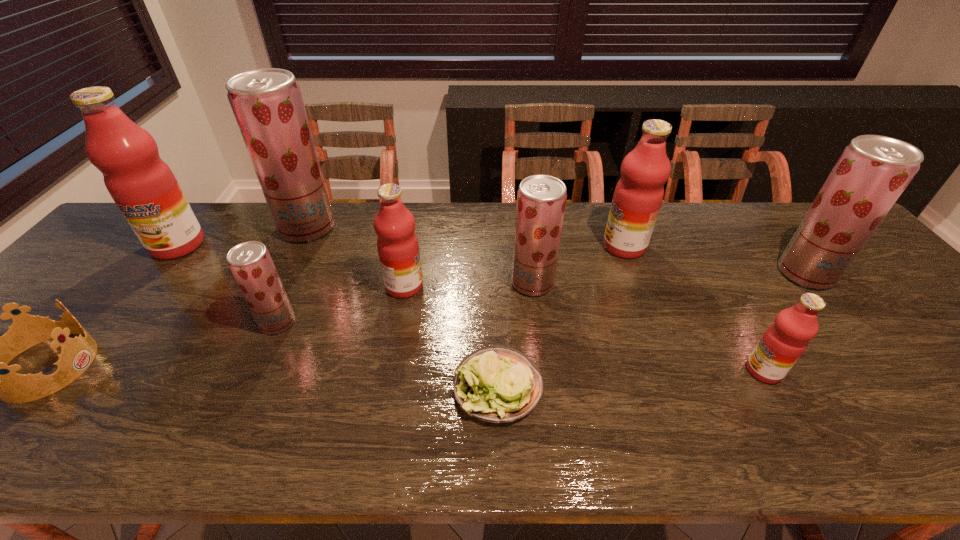
The height and width of the screenshot is (540, 960). Find the location of `object at the near edge`. object at the near edge is located at coordinates (497, 384).

Where is `object located in the left edge section of the desktop`? The image size is (960, 540). object located in the left edge section of the desktop is located at coordinates (143, 186).

Locate an element on the screen. This screenshot has height=540, width=960. object present at the right edge is located at coordinates (872, 172).

This screenshot has height=540, width=960. I want to click on object that is positioned at the far left corner, so click(143, 186).

Find the location of `free region at the far edge`. free region at the far edge is located at coordinates pos(372,245).

The width and height of the screenshot is (960, 540). In the image, there is a desktop. Find the location of `vacant space at the near edge`. vacant space at the near edge is located at coordinates pyautogui.click(x=505, y=433).

This screenshot has width=960, height=540. What are the coordinates of `vacant space at the right edge of the desktop` in the screenshot? It's located at (951, 399).

Identify the location of free space between the green lettuce and the rightmost object. (652, 330).

Locate an element on the screen. The width and height of the screenshot is (960, 540). unoccupied area between the second strawberry fruit juice from right to left and the rightmost pink fruit juice is located at coordinates (648, 327).

The image size is (960, 540). Find the location of `free space that is in between the nearest strawberry fruit juice and the farthest strawberry fruit juice`. free space that is in between the nearest strawberry fruit juice and the farthest strawberry fruit juice is located at coordinates (293, 275).